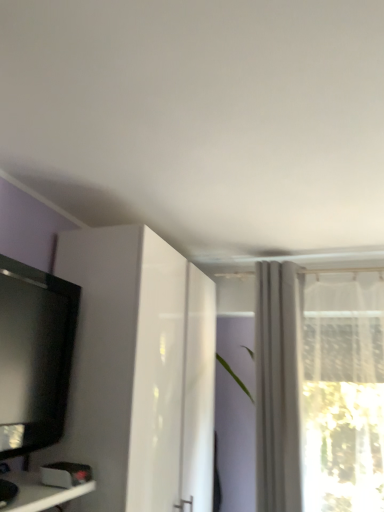
Question: Is the position of black glossy television at left more distant than that of white glossy cabinet at left?

Choices:
 (A) no
 (B) yes

Answer: (A)

Question: Considering the relative sizes of black glossy television at left and white glossy cabinet at left in the image provided, is black glossy television at left thinner than white glossy cabinet at left?

Choices:
 (A) yes
 (B) no

Answer: (A)

Question: Could white glossy cabinet at left be considered to be inside black glossy television at left?

Choices:
 (A) yes
 (B) no

Answer: (B)

Question: Is black glossy television at left smaller than white glossy cabinet at left?

Choices:
 (A) no
 (B) yes

Answer: (B)

Question: From a real-world perspective, is black glossy television at left on white glossy cabinet at left?

Choices:
 (A) no
 (B) yes

Answer: (B)

Question: In terms of size, does white glossy cabinet at left appear bigger or smaller than white sheer curtain at upper right?

Choices:
 (A) big
 (B) small

Answer: (A)

Question: Does point (102, 233) appear closer or farther from the camera than point (256, 320)?

Choices:
 (A) farther
 (B) closer

Answer: (B)

Question: Is white glossy cabinet at left situated inside white sheer curtain at upper right or outside?

Choices:
 (A) inside
 (B) outside

Answer: (B)

Question: Is white glossy cabinet at left taller or shorter than white sheer curtain at upper right?

Choices:
 (A) tall
 (B) short

Answer: (A)

Question: From a real-world perspective, relative to white glossy cabinet at left, is white sheer curtain at upper right vertically above or below?

Choices:
 (A) below
 (B) above

Answer: (B)

Question: Considering the positions of point tap(297, 352) and point tap(182, 367), is point tap(297, 352) closer or farther from the camera than point tap(182, 367)?

Choices:
 (A) closer
 (B) farther

Answer: (B)

Question: Is white sheer curtain at upper right in front of or behind white glossy cabinet at left in the image?

Choices:
 (A) front
 (B) behind

Answer: (B)

Question: Is white sheer curtain at upper right taller or shorter than white glossy cabinet at left?

Choices:
 (A) tall
 (B) short

Answer: (B)

Question: Considering their positions, is black glossy television at left located in front of or behind white glossy cabinet at left?

Choices:
 (A) behind
 (B) front

Answer: (B)

Question: Considering the positions of black glossy television at left and white glossy cabinet at left in the image, is black glossy television at left taller or shorter than white glossy cabinet at left?

Choices:
 (A) short
 (B) tall

Answer: (A)